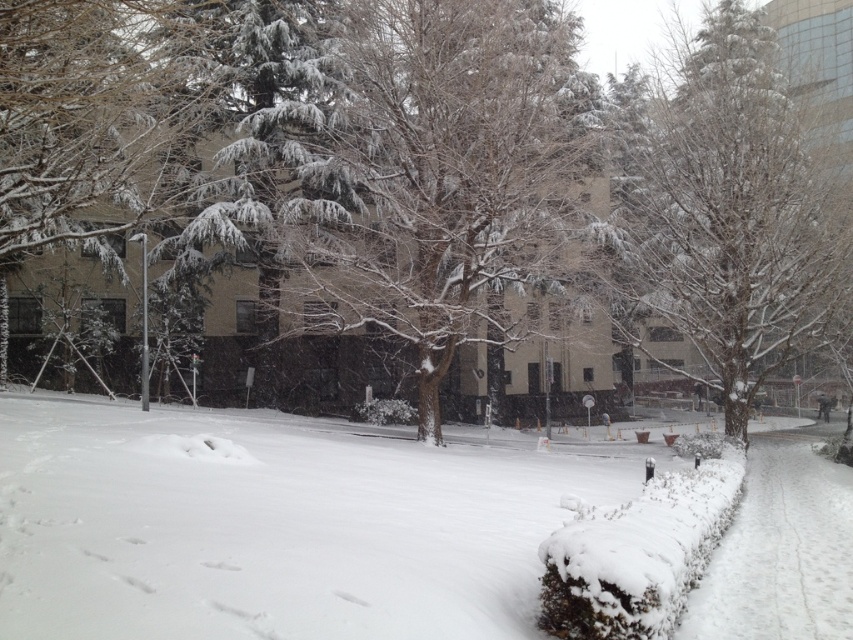
Question: Which object is positioned closest to the white fluffy snow at center?

Choices:
 (A) snow-covered tree at center
 (B) snow-covered tree at right

Answer: (A)

Question: Does white fluffy snow at center have a greater width compared to snow-covered tree at right?

Choices:
 (A) no
 (B) yes

Answer: (B)

Question: Does snow-covered tree at center have a larger size compared to snow-covered tree at right?

Choices:
 (A) no
 (B) yes

Answer: (B)

Question: Estimate the real-world distances between objects in this image. Which object is closer to the white fluffy snow at center?

Choices:
 (A) snow-covered tree at center
 (B) snow-covered tree at right

Answer: (A)

Question: Which of the following is the closest to the observer?

Choices:
 (A) (601, 138)
 (B) (828, 225)
 (C) (431, 632)

Answer: (C)

Question: Can you confirm if snow-covered tree at center is positioned above snow-covered tree at right?

Choices:
 (A) yes
 (B) no

Answer: (B)